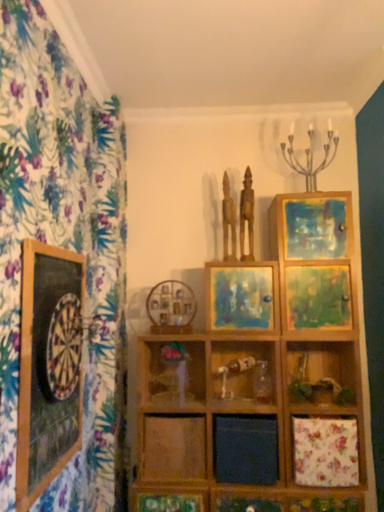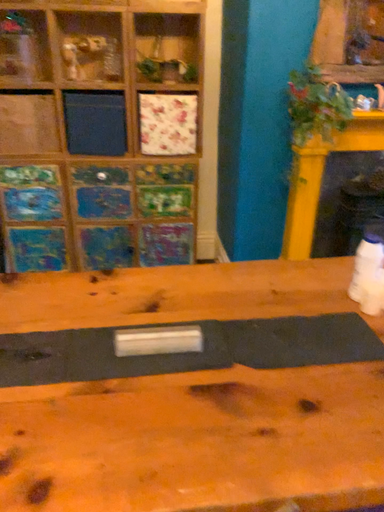
Question: How did the camera likely rotate when shooting the video?

Choices:
 (A) rotated right
 (B) rotated left

Answer: (A)